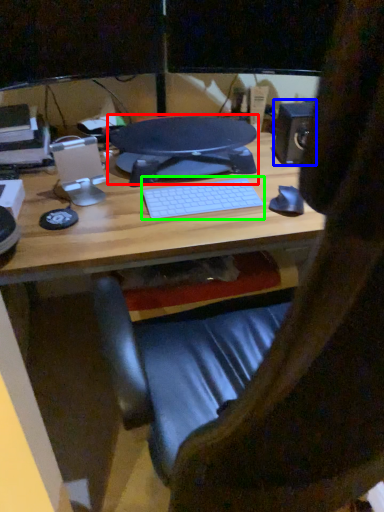
Question: Which is farther away from desktop (highlighted by a red box)? speaker (highlighted by a blue box) or computer keyboard (highlighted by a green box)?

Choices:
 (A) speaker
 (B) computer keyboard

Answer: (A)